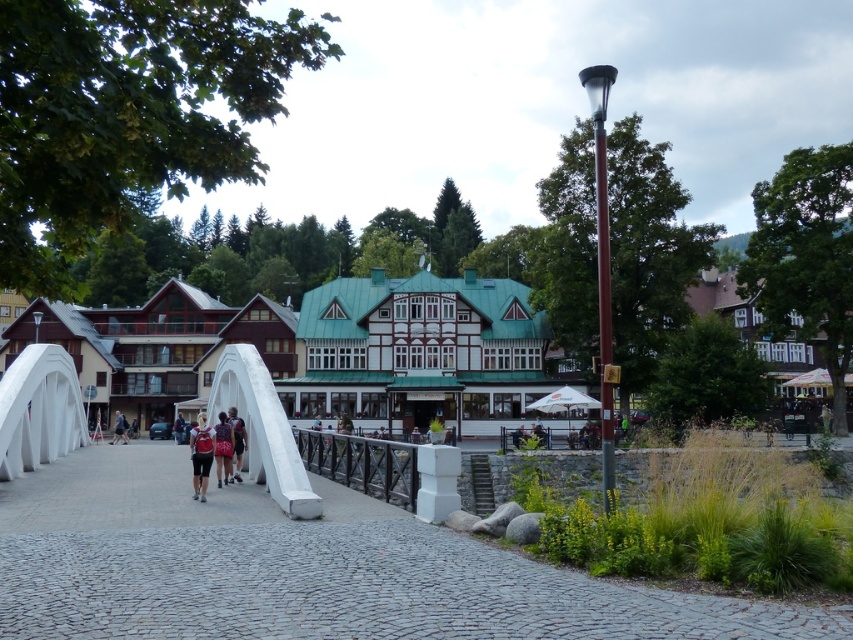
Is point (238, 468) positioned behind point (125, 433)?

No, it is not.

Is red backpack at center taller than dark blue backpack at center?

Yes, red backpack at center is taller than dark blue backpack at center.

In order to click on red backpack at center in this screenshot , I will do `click(236, 440)`.

Is green wooden building at center to the left of dark blue backpack at center from the viewer's perspective?

Incorrect, green wooden building at center is not on the left side of dark blue backpack at center.

Does green wooden building at center have a lesser width compared to dark blue backpack at center?

No, green wooden building at center is not thinner than dark blue backpack at center.

You are a GUI agent. You are given a task and a screenshot of the screen. Output one action in this format:
    pyautogui.click(x=<x>, y=<y>)
    Task: Click on the green wooden building at center
    The image size is (853, 640).
    Given the screenshot: What is the action you would take?
    pyautogui.click(x=317, y=349)

Identify the location of green wooden building at center. (317, 349).

Can you confirm if green wooden building at center is positioned to the left of red fabric backpack at center?

Incorrect, green wooden building at center is not on the left side of red fabric backpack at center.

The height and width of the screenshot is (640, 853). What do you see at coordinates (317, 349) in the screenshot?
I see `green wooden building at center` at bounding box center [317, 349].

Locate an element on the screen. green wooden building at center is located at coordinates (317, 349).